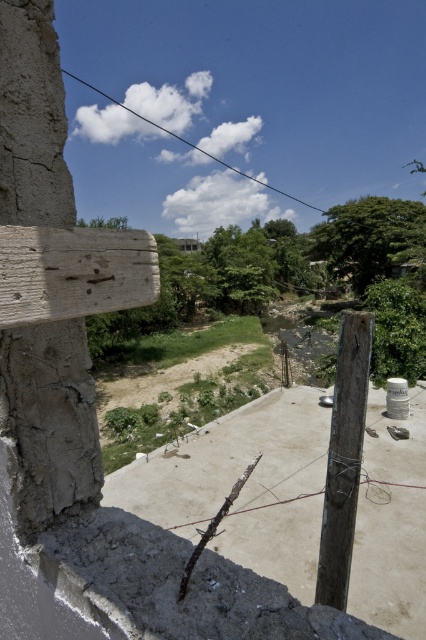
Does weathered wood plank at left have a smaller size compared to weathered wood post at center-right?

Yes.

Does weathered wood plank at left have a greater height compared to weathered wood post at center-right?

No, weathered wood plank at left is not taller than weathered wood post at center-right.

The image size is (426, 640). Find the location of `weathered wood plank at left`. weathered wood plank at left is located at coordinates (74, 273).